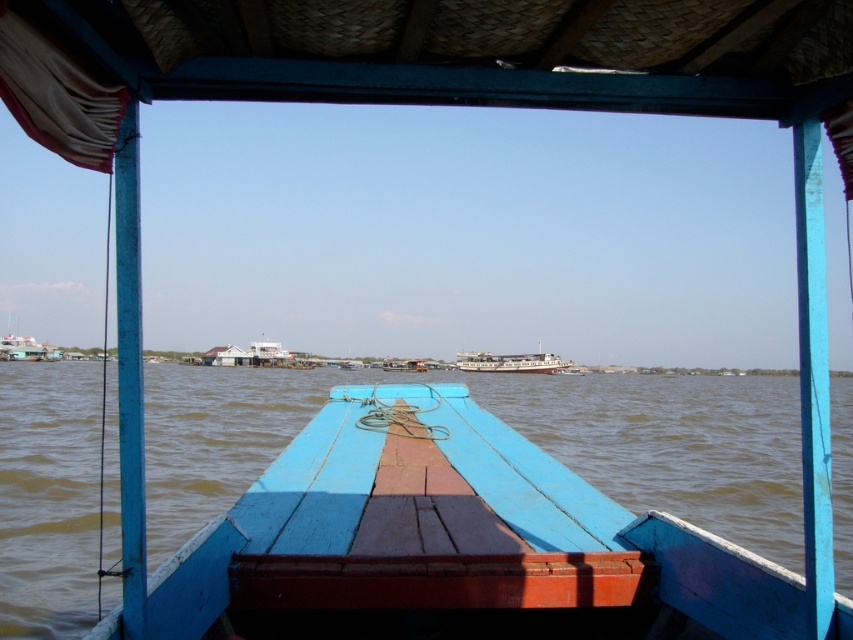
Between brown water at center and white glossy ship at center, which one is positioned higher?

brown water at center

Who is more forward, (x=793, y=557) or (x=537, y=356)?

Point (x=793, y=557) is in front.

The width and height of the screenshot is (853, 640). What are the coordinates of `brown water at center` in the screenshot? It's located at pos(672,444).